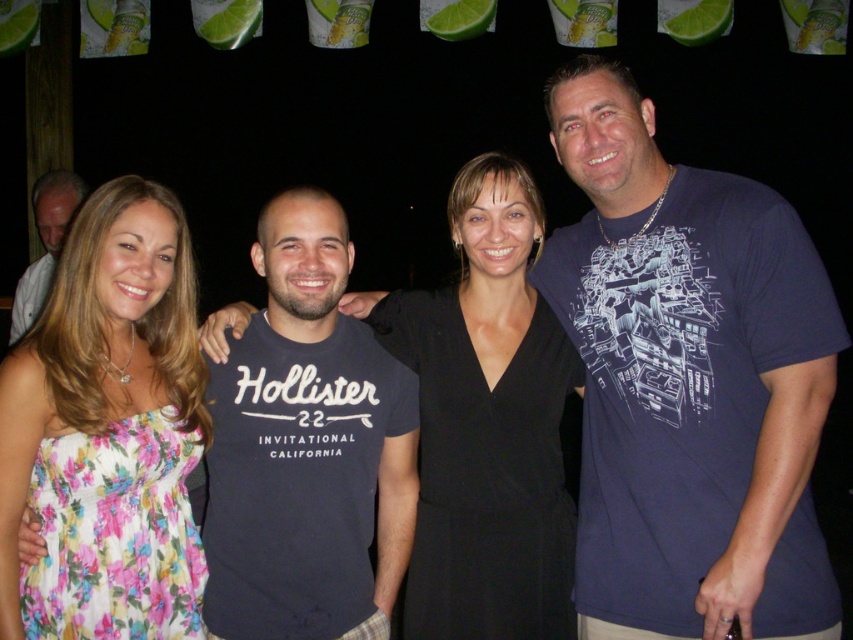
Is matte black t-shirt at center above black matte dress at center?

Actually, matte black t-shirt at center is below black matte dress at center.

Is point (257, 504) in front of point (445, 212)?

Yes, point (257, 504) is in front of point (445, 212).

The width and height of the screenshot is (853, 640). I want to click on matte black t-shirt at center, so click(x=306, y=449).

Who is shorter, black matte dress at center or white shirt at left?

white shirt at left

Can you confirm if black matte dress at center is bigger than white shirt at left?

Yes, black matte dress at center is bigger than white shirt at left.

Between point (519, 312) and point (61, 177), which one is positioned behind?

Positioned behind is point (61, 177).

At what (x,y) coordinates should I click in order to perform the action: click on black matte dress at center. Please return your answer as a coordinate pair (x, y). This screenshot has width=853, height=640. Looking at the image, I should click on (486, 422).

Is dark blue printed t-shirt at center positioned behind matte black t-shirt at center?

No, it is in front of matte black t-shirt at center.

Can you confirm if dark blue printed t-shirt at center is smaller than matte black t-shirt at center?

No, dark blue printed t-shirt at center is not smaller than matte black t-shirt at center.

Identify the location of dark blue printed t-shirt at center. Image resolution: width=853 pixels, height=640 pixels. (688, 381).